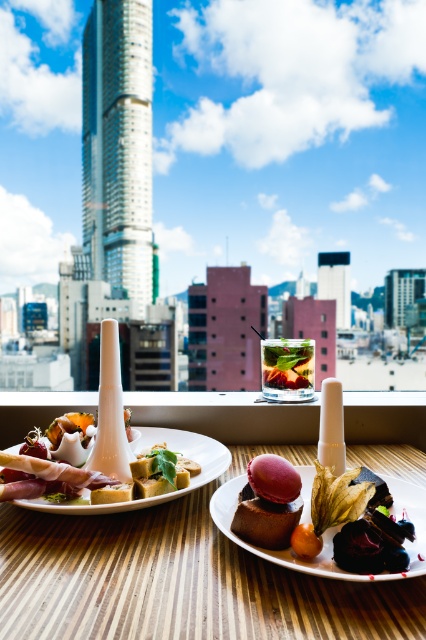
Question: From the image, what is the correct spatial relationship of matte white plate at center in relation to orange matte fruit at center?

Choices:
 (A) left
 (B) right

Answer: (A)

Question: Which point is closer to the camera?

Choices:
 (A) (39, 508)
 (B) (238, 484)

Answer: (A)

Question: Which object is farther from the camera taking this photo?

Choices:
 (A) pink matte macaron at center
 (B) matte white plate at center
 (C) orange matte fruit at center

Answer: (B)

Question: Which object is farther from the camera taking this photo?

Choices:
 (A) matte white plate at center
 (B) orange matte fruit at center
 (C) chocolate cake at center
 (D) green leafy garnish at center

Answer: (D)

Question: Does chocolate cake at center have a greater width compared to pink matte macaron at center?

Choices:
 (A) no
 (B) yes

Answer: (B)

Question: Is pink matte macaron at center positioned in front of orange matte fruit at center?

Choices:
 (A) no
 (B) yes

Answer: (A)